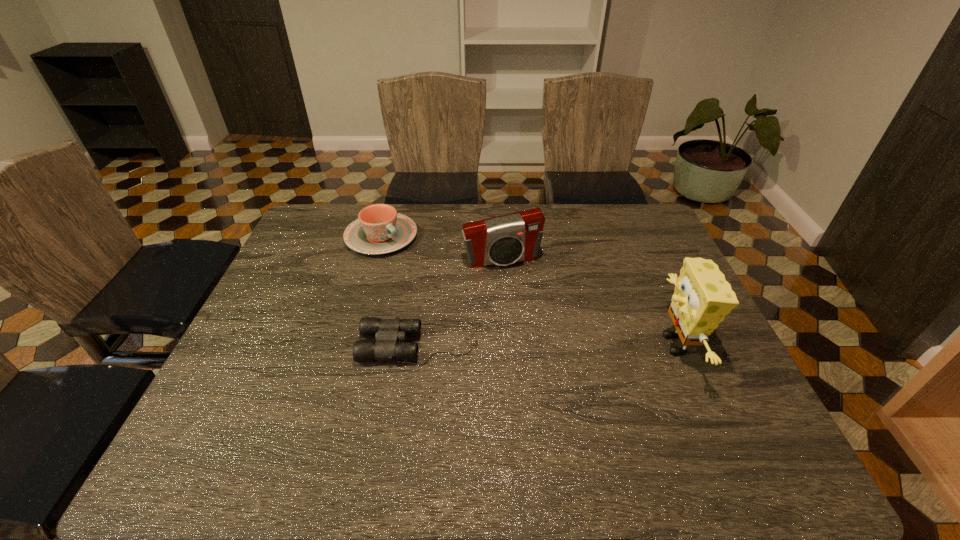
At what (x,y) coordinates should I click in order to perform the action: click on free space on the desktop that is between the binoculars and the sponge and is positioned on the front-facing side of the third shortest object. Please return your answer as a coordinate pair (x, y). Looking at the image, I should click on (533, 344).

Identify the location of free space on the desktop that is between the shortest object and the tallest object and is positioned on the handle side of the second shortest object. (522, 344).